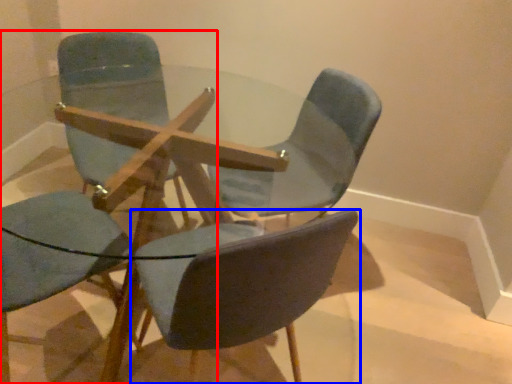
Question: Which object is further to the camera taking this photo, chair (highlighted by a red box) or chair (highlighted by a blue box)?

Choices:
 (A) chair
 (B) chair

Answer: (A)